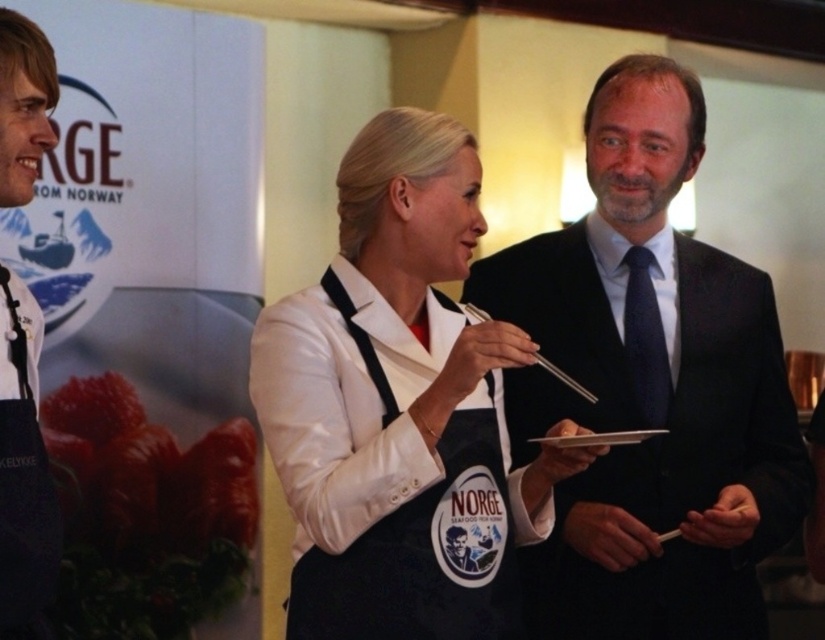
Question: Which object is positioned closest to the dark suit at center?

Choices:
 (A) light brown leather jacket at left
 (B) black fabric apron at center
 (C) white satin apron at center

Answer: (C)

Question: Is white satin apron at center wider than light brown leather jacket at left?

Choices:
 (A) no
 (B) yes

Answer: (B)

Question: Does black fabric apron at center lie in front of light brown leather jacket at left?

Choices:
 (A) no
 (B) yes

Answer: (A)

Question: Is white satin apron at center positioned behind black fabric apron at center?

Choices:
 (A) no
 (B) yes

Answer: (A)

Question: Which is nearer to the light brown leather jacket at left?

Choices:
 (A) white satin apron at center
 (B) dark suit at center

Answer: (A)

Question: Which of the following is the farthest from the observer?

Choices:
 (A) dark suit at center
 (B) light brown leather jacket at left

Answer: (A)